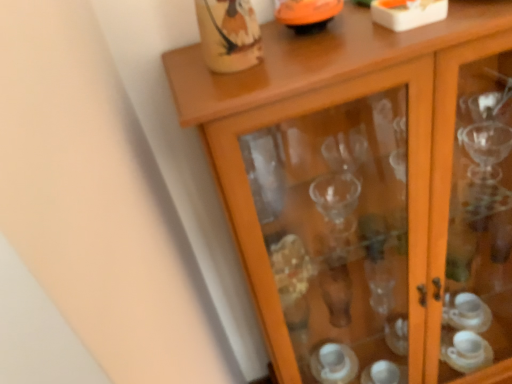
Where is `blank space situated above transparent glass cabinet at upper center (from a real-world perspective)`? The image size is (512, 384). blank space situated above transparent glass cabinet at upper center (from a real-world perspective) is located at coordinates (326, 36).